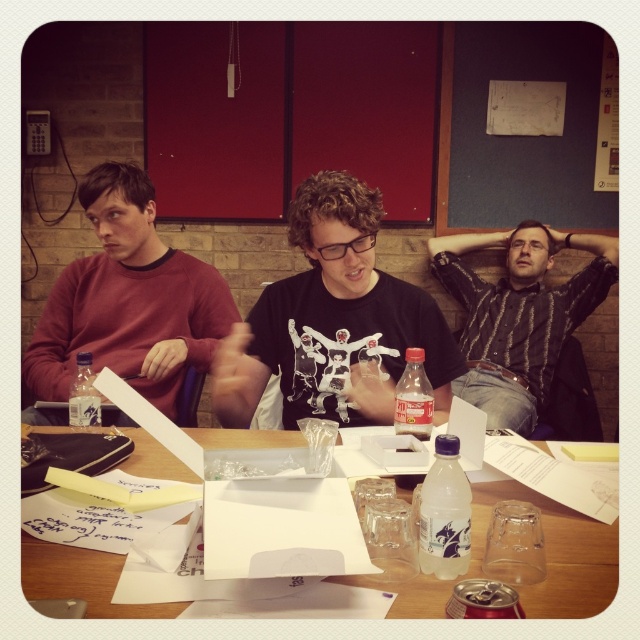
Who is lower down, clear plastic bottle at center or clear plastic bottle at table center?

clear plastic bottle at center is lower down.

Who is more distant from viewer, (429, 506) or (84, 371)?

The point (84, 371) is more distant.

Does point (456, 563) come farther from viewer compared to point (88, 372)?

No, it is in front of (88, 372).

What are the coordinates of `clear plastic bottle at center` in the screenshot? It's located at (444, 513).

Is matte red sweater at left smaller than clear plastic bottle at center?

Actually, matte red sweater at left might be larger than clear plastic bottle at center.

Is matte red sweater at left thinner than clear plastic bottle at center?

In fact, matte red sweater at left might be wider than clear plastic bottle at center.

Which is behind, point (108, 177) or point (464, 513)?

Point (108, 177)

The height and width of the screenshot is (640, 640). What are the coordinates of `matte red sweater at left` in the screenshot? It's located at (129, 300).

Is the position of matte red sweater at left more distant than that of translucent plastic bottle at center?

Yes, it is.

Does matte red sweater at left have a lesser height compared to translucent plastic bottle at center?

In fact, matte red sweater at left may be taller than translucent plastic bottle at center.

The width and height of the screenshot is (640, 640). In order to click on matte red sweater at left in this screenshot , I will do `click(129, 300)`.

Where is `matte red sweater at left`? This screenshot has width=640, height=640. matte red sweater at left is located at coordinates (129, 300).